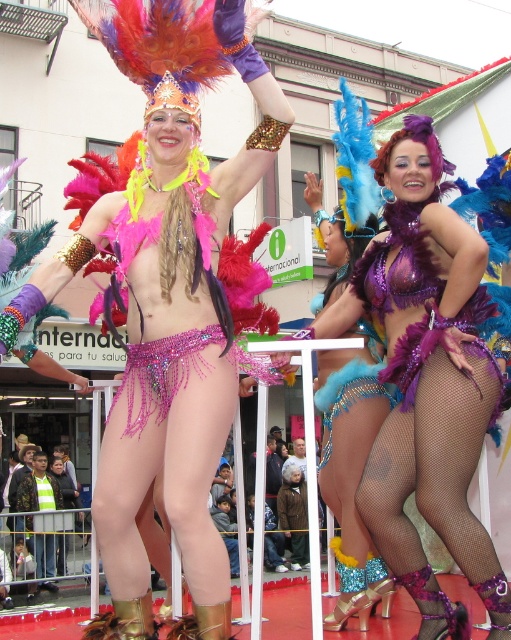
Between point (413, 548) and point (332, 406), which one is positioned in front?

Point (413, 548) is in front.

Is shiny purple bikini at center thinner than shiny blue fabric at center?

Incorrect, shiny purple bikini at center's width is not less than shiny blue fabric at center's.

Between point (425, 232) and point (336, 300), which one is positioned in front?

Point (425, 232) is more forward.

At what (x,y) coordinates should I click in order to perform the action: click on shiny purple bikini at center. Please return your answer as a coordinate pair (x, y). The width and height of the screenshot is (511, 640). Looking at the image, I should click on (429, 385).

Is shiny sequined bikini at center thinner than shiny blue fabric at center?

No, shiny sequined bikini at center is not thinner than shiny blue fabric at center.

Is point (110, 572) closer to viewer compared to point (347, 468)?

Yes, point (110, 572) is closer to viewer.

At what (x,y) coordinates should I click in order to perform the action: click on shiny sequined bikini at center. Please return your answer as a coordinate pair (x, y). Looking at the image, I should click on (168, 292).

Is point (251, 163) closer to camera compared to point (421, 554)?

No, (251, 163) is further to viewer.

Is shiny sequined bikini at center to the left of shiny purple bikini at center from the viewer's perspective?

Yes, shiny sequined bikini at center is to the left of shiny purple bikini at center.

Locate an element on the screen. The height and width of the screenshot is (640, 511). shiny sequined bikini at center is located at coordinates (168, 292).